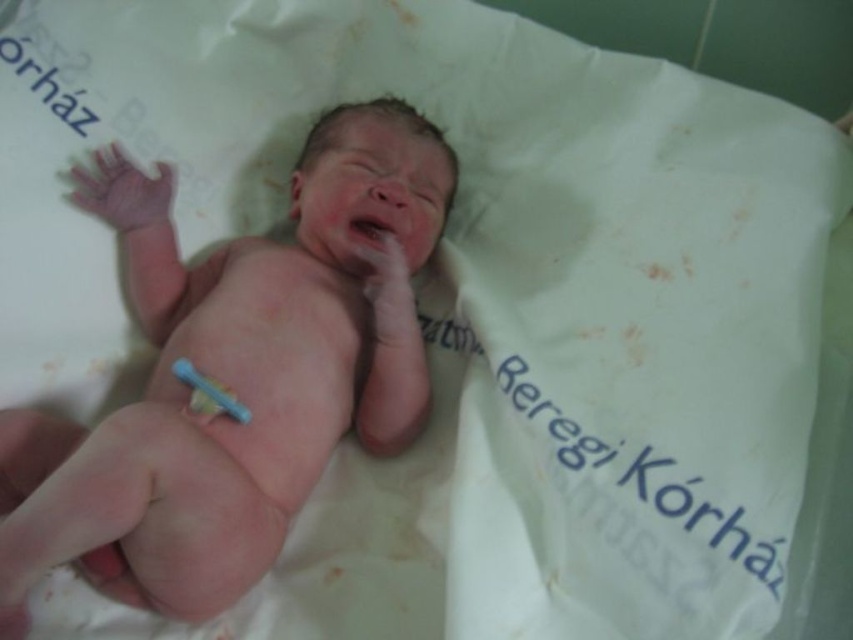
Question: Which point is farther to the camera?

Choices:
 (A) blue plastic toothbrush at lower center
 (B) pink smooth flesh at center
 (C) pink smooth skin at center

Answer: (B)

Question: Considering the relative positions of pink smooth skin at center and pink smooth flesh at center in the image provided, where is pink smooth skin at center located with respect to pink smooth flesh at center?

Choices:
 (A) left
 (B) right

Answer: (A)

Question: Considering the real-world distances, which object is closest to the blue plastic toothbrush at lower center?

Choices:
 (A) pink smooth flesh at center
 (B) pink smooth skin at center

Answer: (B)

Question: Which point is closer to the camera?

Choices:
 (A) pink smooth skin at center
 (B) blue plastic toothbrush at lower center
 (C) pink smooth flesh at center

Answer: (A)

Question: Can you confirm if pink smooth flesh at center is positioned to the left of blue plastic toothbrush at lower center?

Choices:
 (A) yes
 (B) no

Answer: (B)

Question: Does pink smooth skin at center have a greater width compared to pink smooth flesh at center?

Choices:
 (A) no
 (B) yes

Answer: (B)